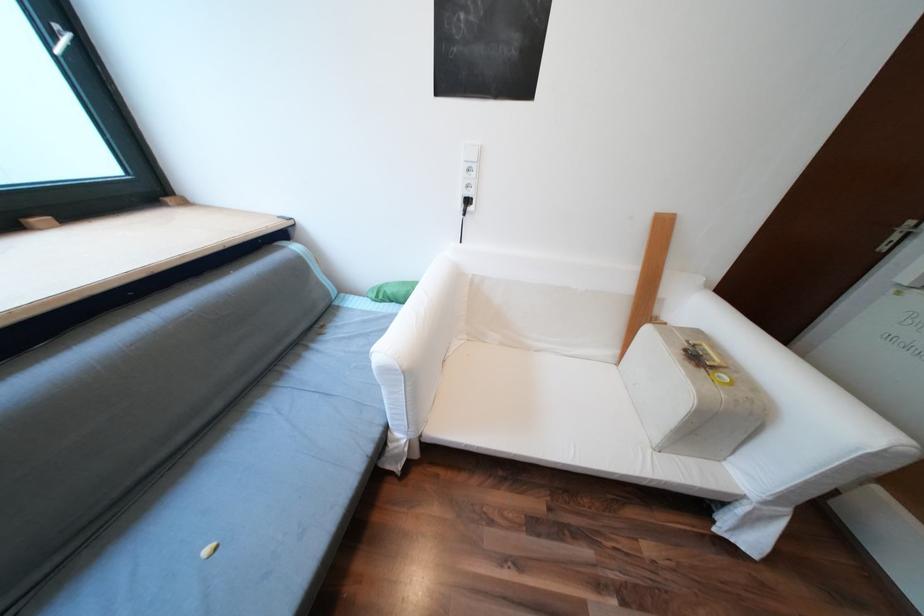
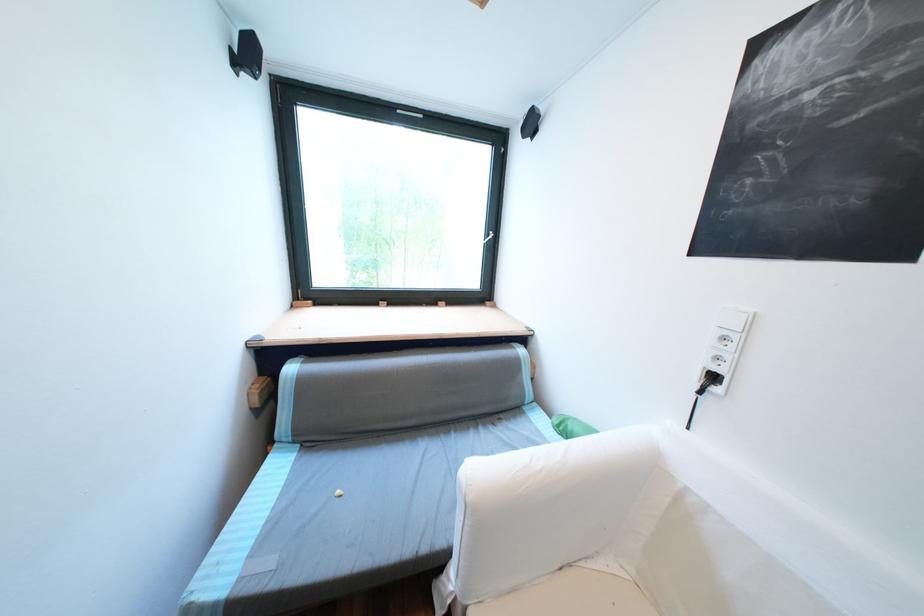
In the second image, find the point that corresponds to the point at 480,209 in the first image.

(725, 390)